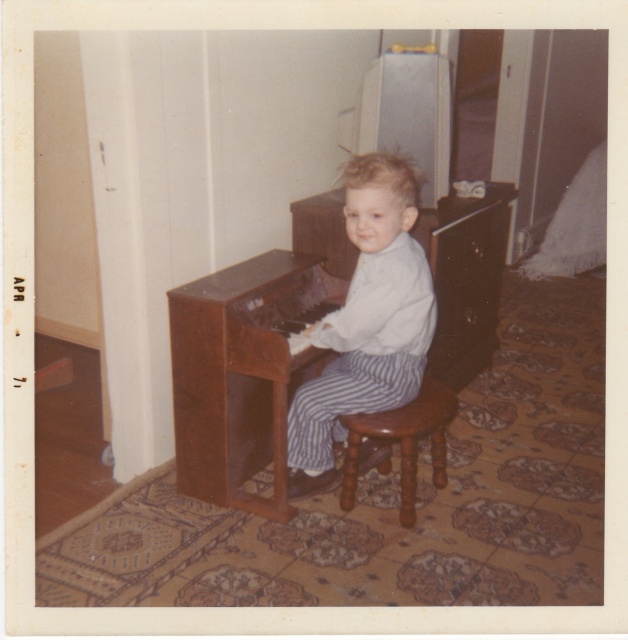
You are a photographer setting up a shoot in the room. You need to ensure that the wooden piano at center and the white striped pants at center are both visible in the frame. Based on their positions, which object is closer to the camera?

The wooden piano at center is positioned under the white striped pants at center, meaning the white striped pants at center is closer to the camera.

From the picture: You are a photographer setting up for a family photo. You notice the white striped pants at center and the brown wooden stool at center in the scene. Which object is covering the other?

The white striped pants at center is positioned over the brown wooden stool at center, so the pants are covering the stool.